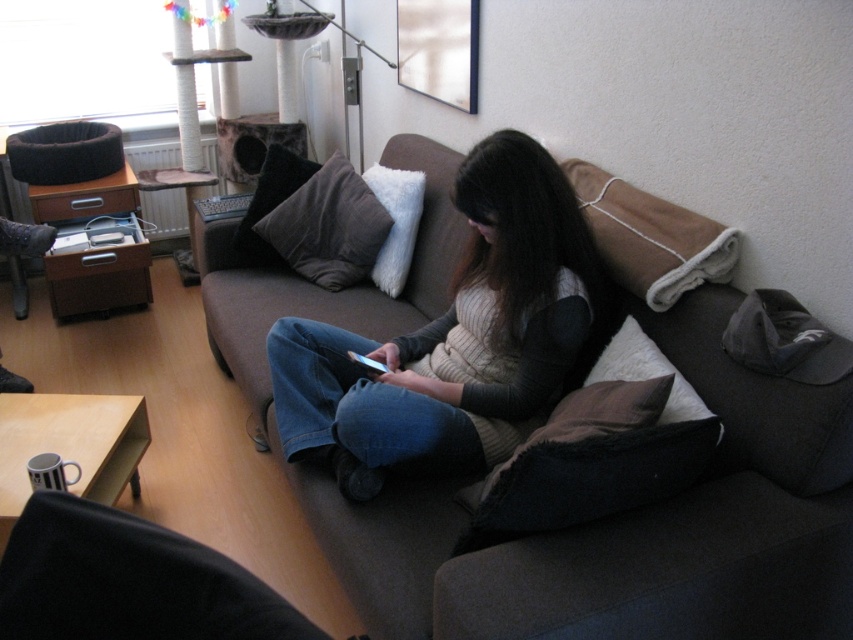
Question: Does knit sweater at center have a lesser width compared to burlap/cotton blanket at upper right?

Choices:
 (A) no
 (B) yes

Answer: (A)

Question: Which object appears farthest from the camera in this image?

Choices:
 (A) black fabric at lower left
 (B) burlap/cotton blanket at upper right
 (C) brown fabric couch at center
 (D) brown soft cushion at center

Answer: (D)

Question: Is black fabric at lower left above white fluffy pillow at center?

Choices:
 (A) yes
 (B) no

Answer: (B)

Question: Which point is farther to the camera?

Choices:
 (A) (643, 312)
 (B) (329, 253)
 (C) (537, 216)

Answer: (B)

Question: Which of the following is the closest to the observer?

Choices:
 (A) (293, 224)
 (B) (245, 218)

Answer: (A)

Question: Does brown fabric couch at center have a lesser width compared to brown velvet pillow at center?

Choices:
 (A) no
 (B) yes

Answer: (A)